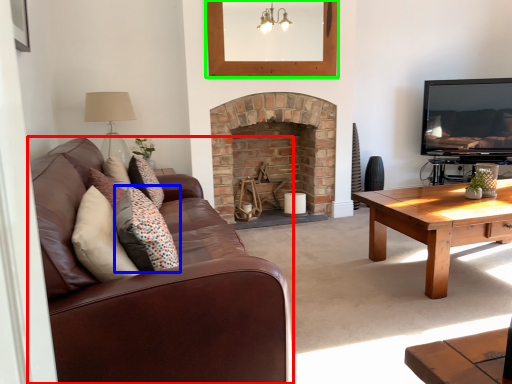
Question: Considering the real-world distances, which object is closest to studio couch (highlighted by a red box)? pillow (highlighted by a blue box) or picture frame (highlighted by a green box).

Choices:
 (A) pillow
 (B) picture frame

Answer: (A)